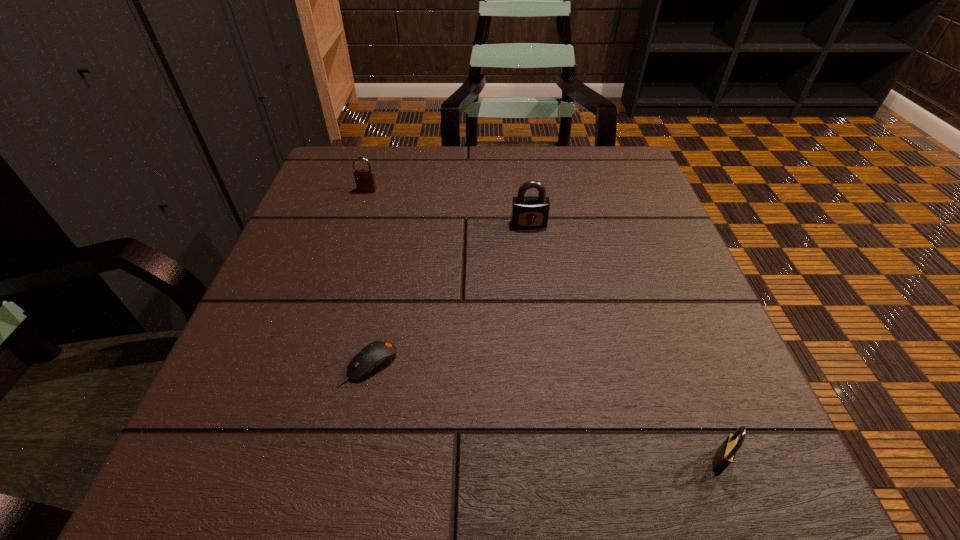
You are a GUI agent. You are given a task and a screenshot of the screen. Output one action in this format:
    pyautogui.click(x=<x>, y=<y>)
    Task: Click on the vacant area in the image that satisfies the following two spatial constraints: 1. on the front of the rightmost padlock near the keyhole; 2. on the left side of the second farthest object
    The image size is (960, 540).
    Given the screenshot: What is the action you would take?
    pyautogui.click(x=559, y=461)

Where is `free space that satisfies the following two spatial constraints: 1. on the front-facing side of the second object from left to right; 2. on the left side of the leftmost object`? free space that satisfies the following two spatial constraints: 1. on the front-facing side of the second object from left to right; 2. on the left side of the leftmost object is located at coordinates (312, 365).

Locate an element on the screen. The width and height of the screenshot is (960, 540). vacant region that satisfies the following two spatial constraints: 1. on the front-facing side of the leftmost padlock; 2. on the right side of the nearest padlock is located at coordinates (281, 461).

Find the location of a particular element. This screenshot has height=540, width=960. vacant position in the image that satisfies the following two spatial constraints: 1. on the front-facing side of the farthest object; 2. on the right side of the nearest padlock is located at coordinates (281, 461).

You are a GUI agent. You are given a task and a screenshot of the screen. Output one action in this format:
    pyautogui.click(x=<x>, y=<y>)
    Task: Click on the free location that satisfies the following two spatial constraints: 1. on the front-facing side of the farthest padlock; 2. on the left side of the nearest object
    Image resolution: width=960 pixels, height=540 pixels.
    Given the screenshot: What is the action you would take?
    pyautogui.click(x=281, y=461)